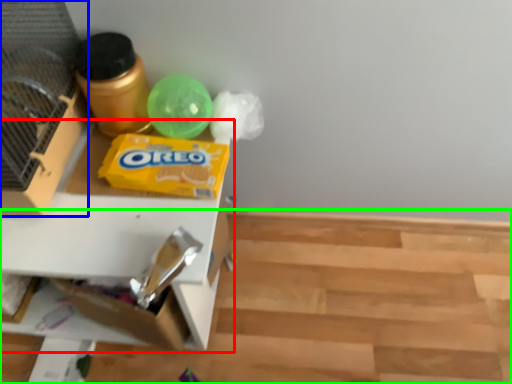
Question: Estimate the real-world distances between objects in this image. Which object is closer to table (highlighted by a red box), bird cage (highlighted by a blue box) or wood (highlighted by a green box)?

Choices:
 (A) bird cage
 (B) wood

Answer: (A)